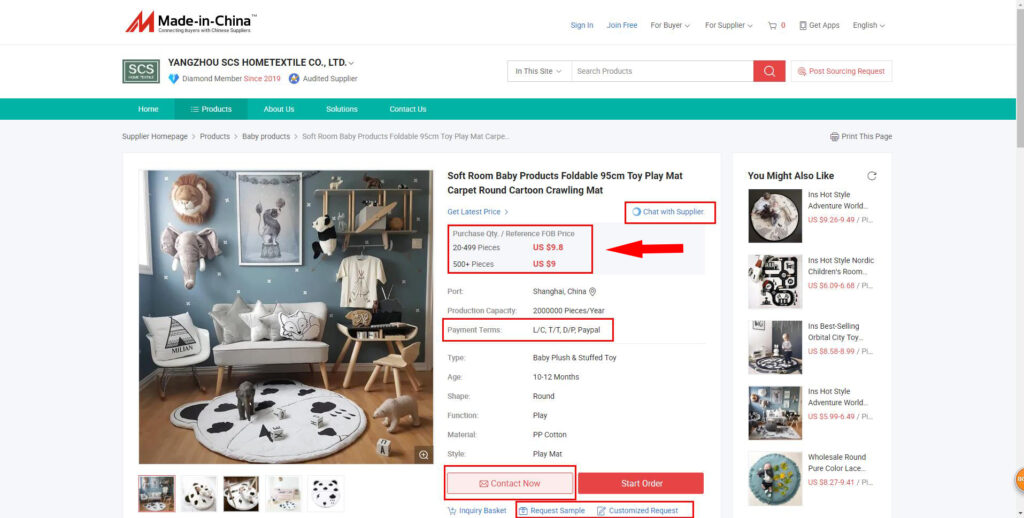
You are a GUI agent. You are given a task and a screenshot of the screen. Output one action in this format:
    pyautogui.click(x=<x>, y=<y>)
    Task: Click on the white pillow with black teepee
    The image size is (1024, 518).
    Given the screenshot: What is the action you would take?
    pyautogui.click(x=174, y=332)